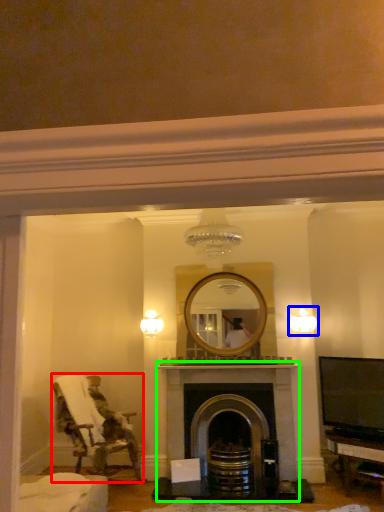
Question: Which object is the farthest from chair (highlighted by a red box)? Choose among these: light fixture (highlighted by a blue box) or fireplace (highlighted by a green box).

Choices:
 (A) light fixture
 (B) fireplace

Answer: (A)